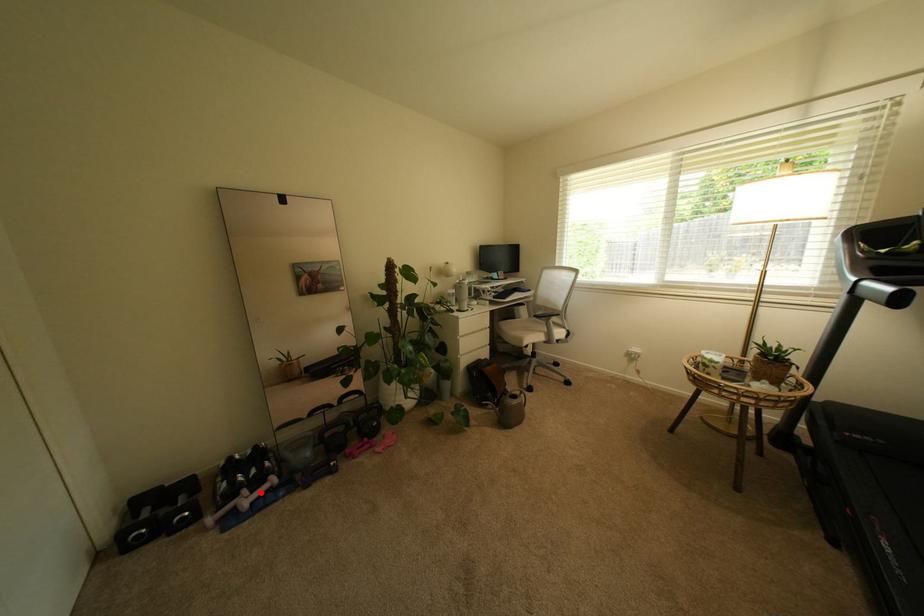
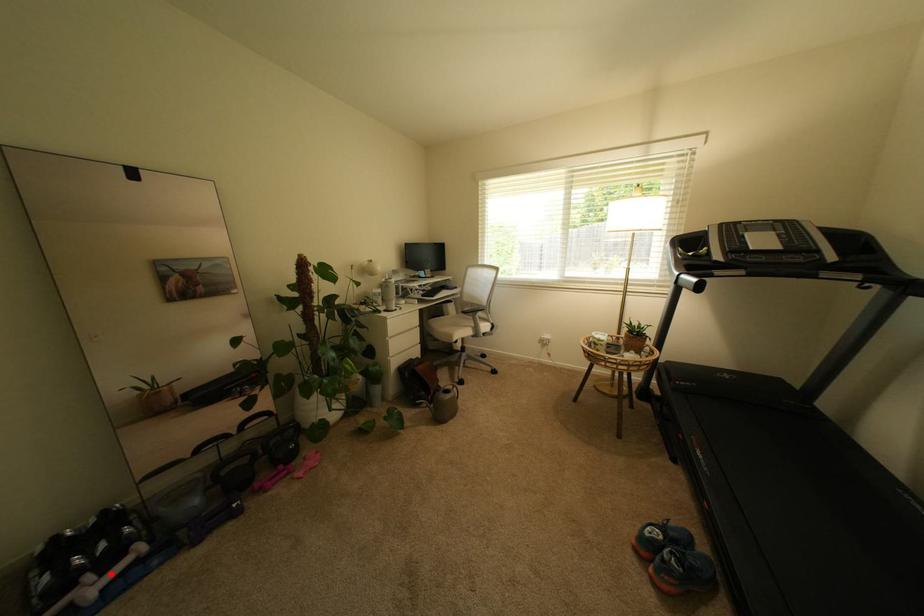
I am providing you with two images of the same scene from different viewpoints. A red point is marked on the first image and another point is marked on the second image. Do the highlighted points in image1 and image2 indicate the same real-world spot?

Yes